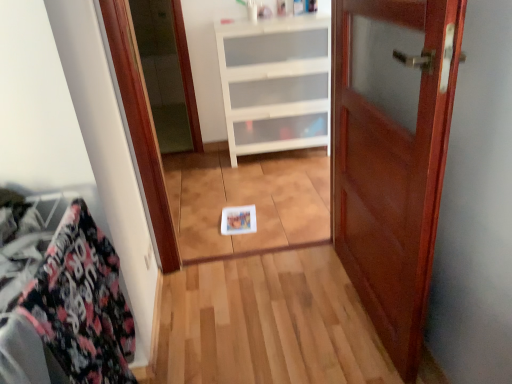
Locate an element on the screen. This screenshot has width=512, height=384. vacant area to the left of mahogany wood door at center is located at coordinates (283, 312).